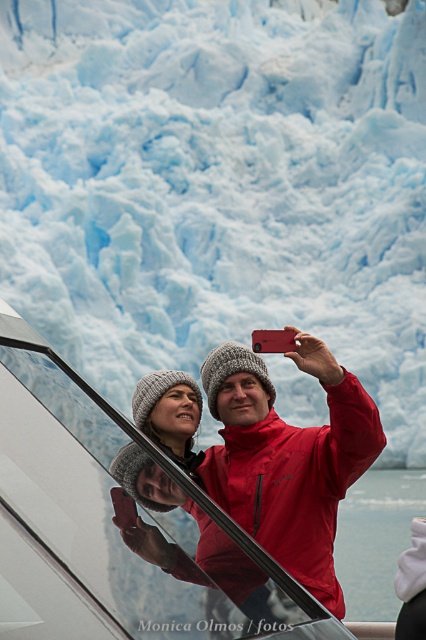
Based on the photo, who is taller, glacial ice at upper center or matte red jacket at center?

glacial ice at upper center

Can you confirm if glacial ice at upper center is positioned above matte red jacket at center?

Indeed, glacial ice at upper center is positioned over matte red jacket at center.

Locate an element on the screen. This screenshot has height=640, width=426. glacial ice at upper center is located at coordinates (218, 186).